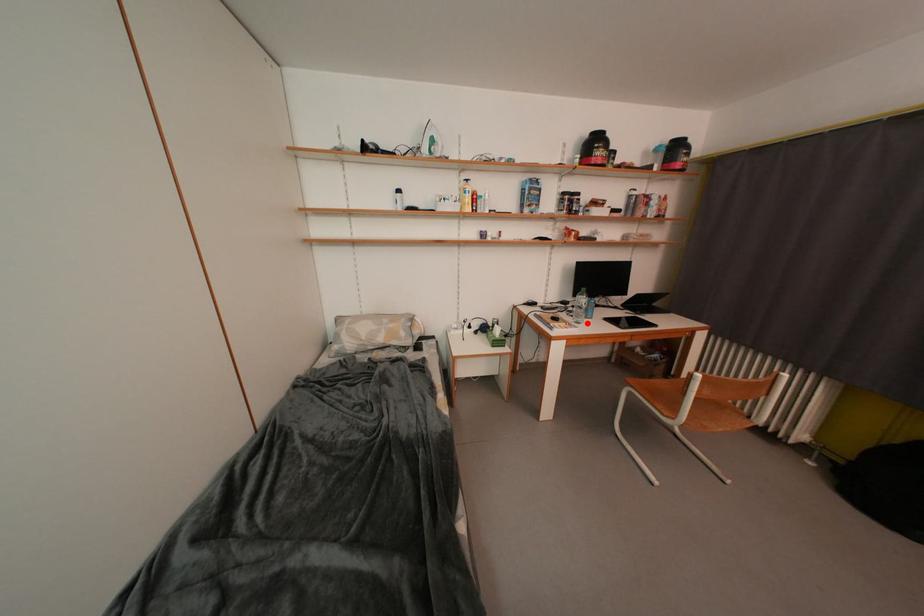
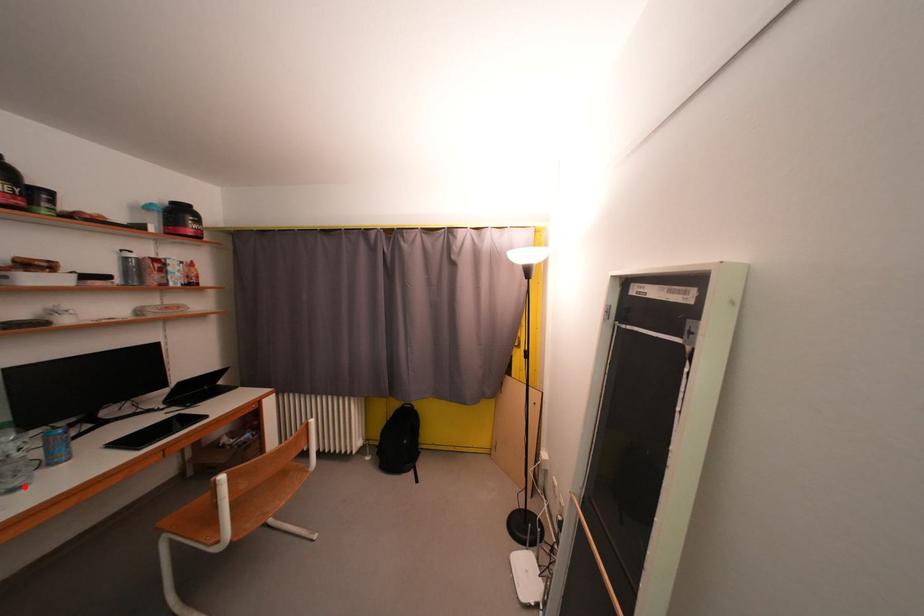
I am providing you with two images of the same scene from different viewpoints. A red point is marked on the first image and another point is marked on the second image. Is the marked point in image1 the same physical position as the marked point in image2?

Yes